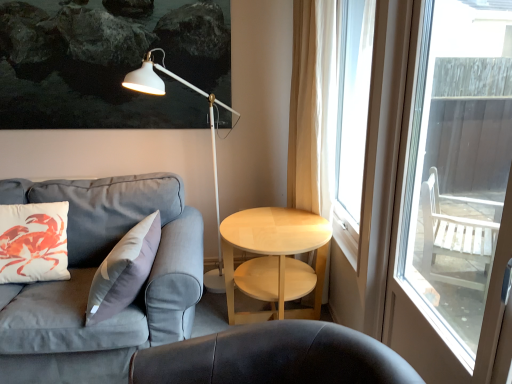
Question: Is white sheer curtain at right inside the boundaries of gray fabric couch at left, or outside?

Choices:
 (A) outside
 (B) inside

Answer: (A)

Question: Looking at their shapes, would you say white sheer curtain at right is wider or thinner than gray fabric couch at left?

Choices:
 (A) thin
 (B) wide

Answer: (A)

Question: Estimate the real-world distances between objects in this image. Which object is farther from the white sheer curtain at right?

Choices:
 (A) white glossy table at right
 (B) white matte floor lamp at upper center
 (C) gray fabric couch at left
 (D) white sheer curtain at right
 (E) white matte pillow at left

Answer: (E)

Question: Which object is positioned closest to the white sheer curtain at right?

Choices:
 (A) white sheer curtain at right
 (B) white glossy table at right
 (C) white matte floor lamp at upper center
 (D) transparent glass door at right
 (E) gray fabric couch at left

Answer: (A)